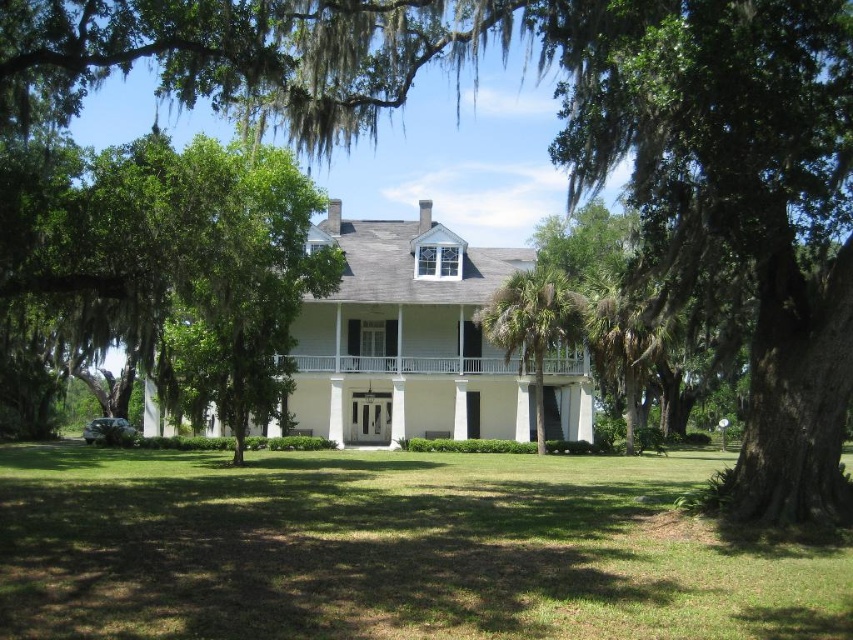
Question: Which object is positioned farthest from the green grass at center?

Choices:
 (A) green leafy palm tree at center
 (B) white wooden porch at center

Answer: (A)

Question: Which object is the closest to the green grass at center?

Choices:
 (A) white wooden porch at center
 (B) green leafy palm tree at center

Answer: (A)

Question: Does green grass at center have a greater width compared to white wooden porch at center?

Choices:
 (A) yes
 (B) no

Answer: (A)

Question: Can you confirm if green grass at center is positioned below green leafy palm tree at center?

Choices:
 (A) yes
 (B) no

Answer: (A)

Question: Which object is the closest to the green leafy palm tree at center?

Choices:
 (A) white wooden porch at center
 (B) green grass at center

Answer: (A)

Question: Is green grass at center to the left of white wooden porch at center from the viewer's perspective?

Choices:
 (A) yes
 (B) no

Answer: (A)